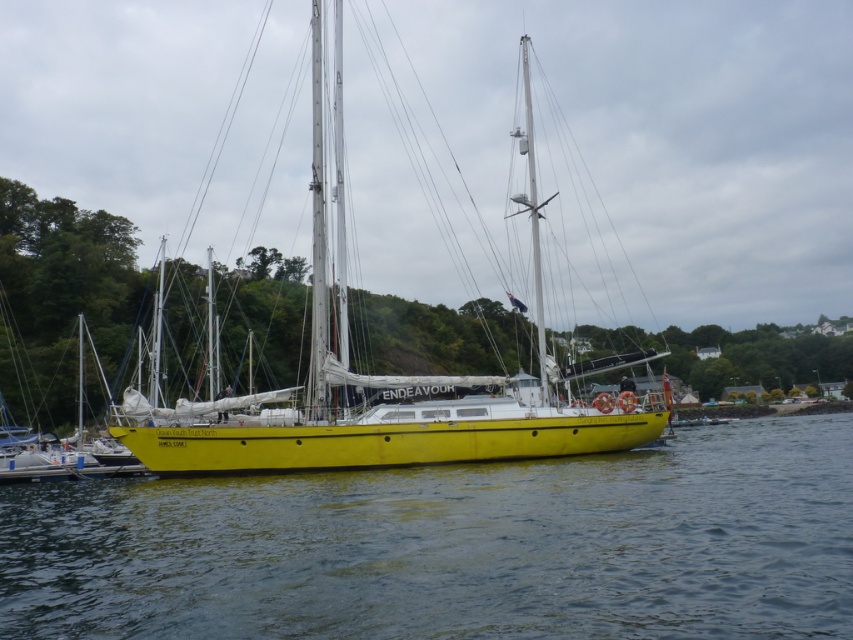
You are a photographer planning to take a photo of the yellow matte water at center and the yellow matte sailboat at center. Based on their sizes in the image, which object would appear larger in the photo?

The yellow matte sailboat at center appears larger than the yellow matte water at center in the photo because the yellow matte water at center is not as tall as the yellow matte sailboat at center.

You are a photographer planning to capture the yellow matte sailboat at center and the yellow matte water at center in a wide shot. Based on the scene, which object will occupy more horizontal space in the photo?

The yellow matte water at center will occupy more horizontal space in the photo because its width is larger than that of the yellow matte sailboat at center.

You are standing on the dock next to the ENDEAVOUR sailboat. You want to reach a specific point marked at coordinates point (x=283, y=492) on the boat. If you can walk 100 feet in 2 minutes, how long will it take you to reach that point?

The distance of point (x=283, y=492) from camera is 92.62 feet. Since you can walk 100 feet in 2 minutes, reaching 92.62 feet would take approximately 1.85 minutes, which is roughly 1 minute and 51 seconds.